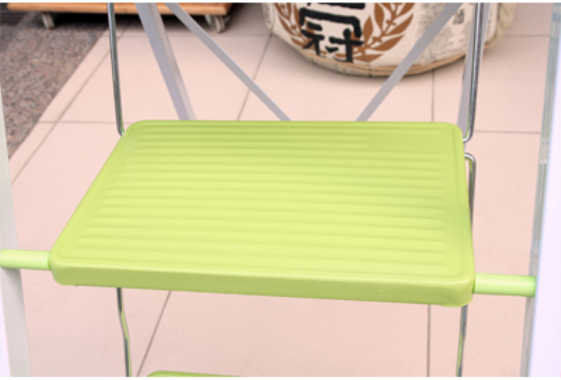
You are a GUI agent. You are given a task and a screenshot of the screen. Output one action in this format:
    pyautogui.click(x=<x>, y=<y>)
    Task: Click on the metal chair supports
    Image resolution: width=561 pixels, height=380 pixels.
    Given the screenshot: What is the action you would take?
    pyautogui.click(x=465, y=121), pyautogui.click(x=542, y=185), pyautogui.click(x=164, y=64), pyautogui.click(x=114, y=78), pyautogui.click(x=121, y=309)